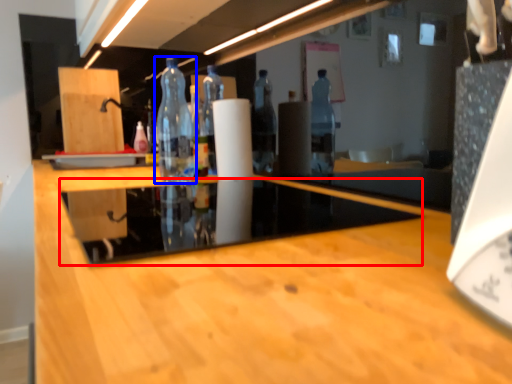
Question: Which object appears farthest to the camera in this image, glass table (highlighted by a red box) or bottle (highlighted by a blue box)?

Choices:
 (A) glass table
 (B) bottle

Answer: (B)